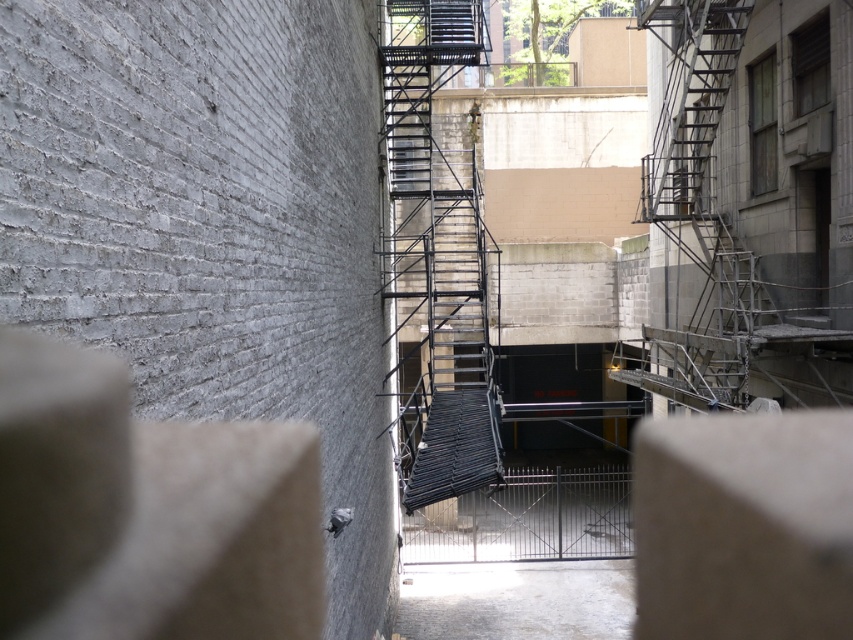
Question: Which of the following is the farthest from the observer?

Choices:
 (A) metallic black staircase at center
 (B) metallic gray fire escape at center

Answer: (B)

Question: Does black metal fire escape at center appear on the left side of metallic gray fire escape at center?

Choices:
 (A) no
 (B) yes

Answer: (B)

Question: Can you confirm if black metal fire escape at center is thinner than metallic gray fire escape at center?

Choices:
 (A) no
 (B) yes

Answer: (A)

Question: Which object appears farthest from the camera in this image?

Choices:
 (A) black metal fire escape at center
 (B) metallic gray fire escape at center
 (C) metallic black staircase at center

Answer: (B)

Question: Can you confirm if black metal fire escape at center is smaller than metallic black staircase at center?

Choices:
 (A) no
 (B) yes

Answer: (A)

Question: Among these objects, which one is farthest from the camera?

Choices:
 (A) black metal fire escape at center
 (B) metallic gray fire escape at center
 (C) metallic black staircase at center

Answer: (B)